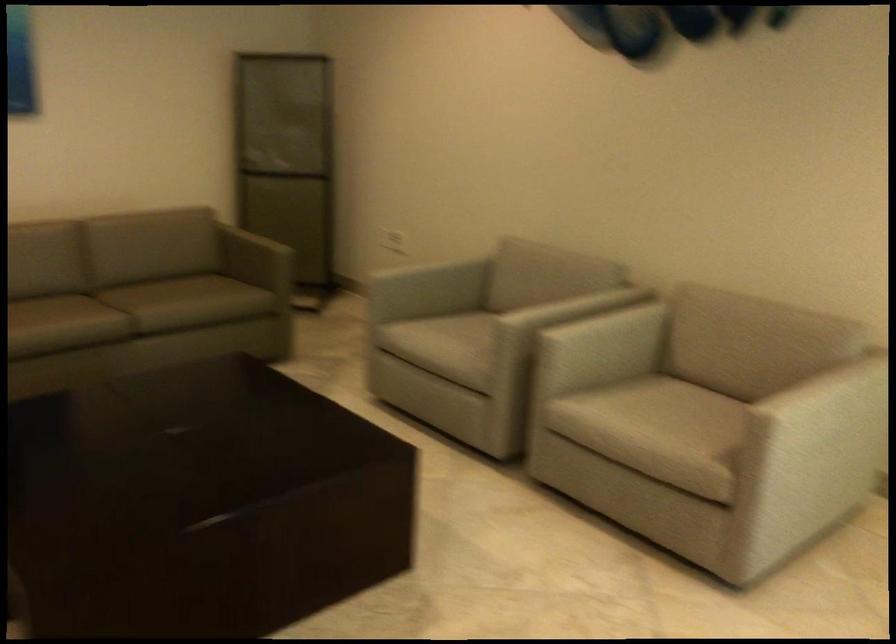
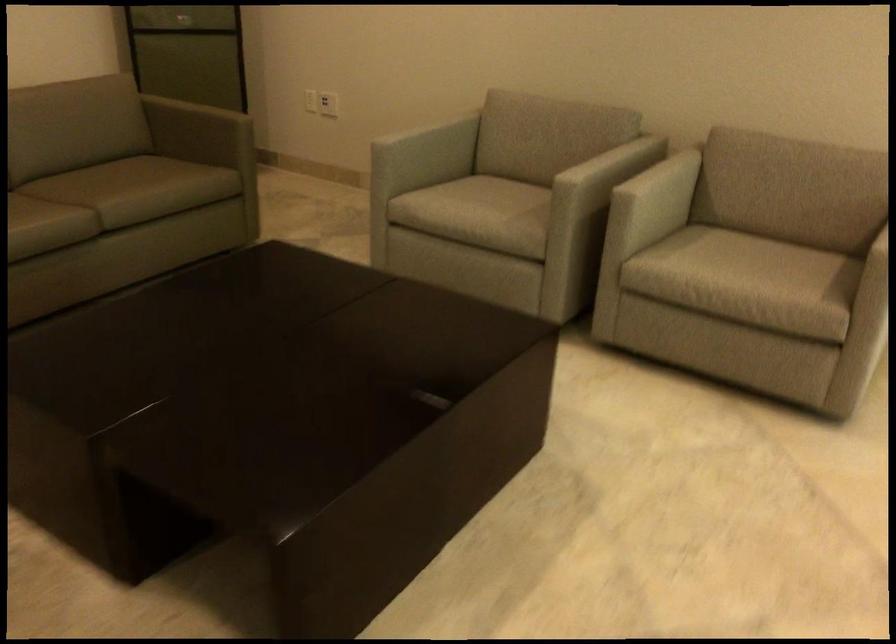
Locate, in the second image, the point that corresponds to point 564,294 in the first image.

(588, 149)